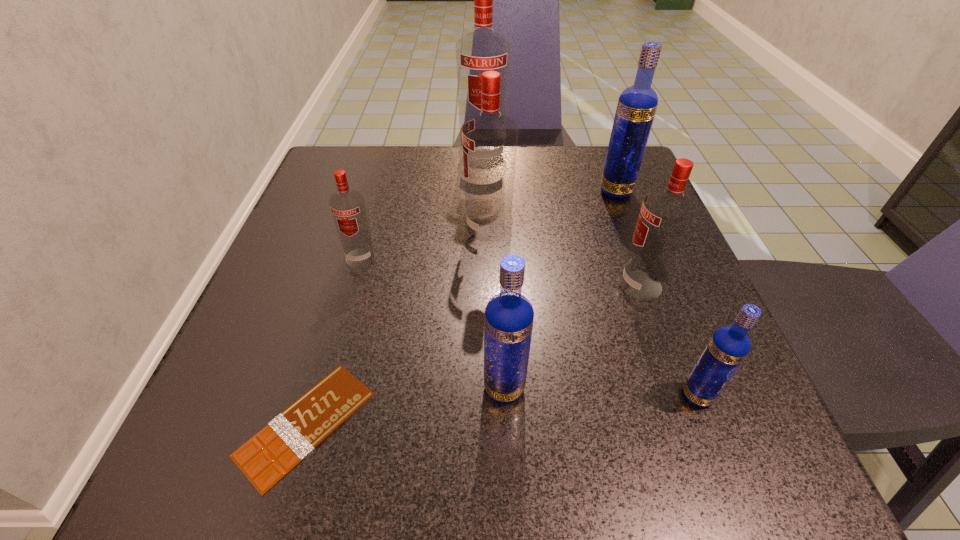
Locate an element on the screen. The image size is (960, 540). vacant area situated 0.230m on the front label of the second smallest red vodka is located at coordinates (486, 285).

Locate an element on the screen. The height and width of the screenshot is (540, 960). free space located 0.100m on the front label of the second smallest red vodka is located at coordinates (562, 285).

Locate an element on the screen. The width and height of the screenshot is (960, 540). vacant area located 0.150m on the back of the smallest blue vodka is located at coordinates (661, 303).

Identify the location of free region located on the front label of the leftmost red vodka. (324, 386).

Where is `free space located 0.080m on the back of the chocolate bar`? free space located 0.080m on the back of the chocolate bar is located at coordinates (336, 323).

Identify the location of object that is at the near edge. The height and width of the screenshot is (540, 960). (267, 457).

Identify the location of vodka that is at the left edge. (348, 209).

The height and width of the screenshot is (540, 960). Find the location of `chocolate bar present at the left edge`. chocolate bar present at the left edge is located at coordinates (267, 457).

Identify the location of object present at the near left corner. This screenshot has width=960, height=540. (267, 457).

At what (x,y) coordinates should I click in order to perform the action: click on object present at the far right corner. Please return your answer as a coordinate pair (x, y). This screenshot has width=960, height=540. Looking at the image, I should click on (637, 104).